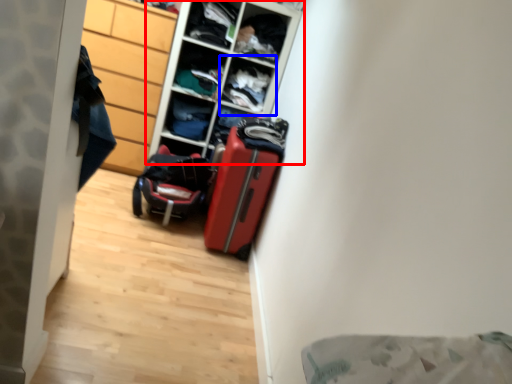
Question: Which object appears closest to the camera in this image, shelf (highlighted by a red box) or cabinet (highlighted by a blue box)?

Choices:
 (A) shelf
 (B) cabinet

Answer: (A)